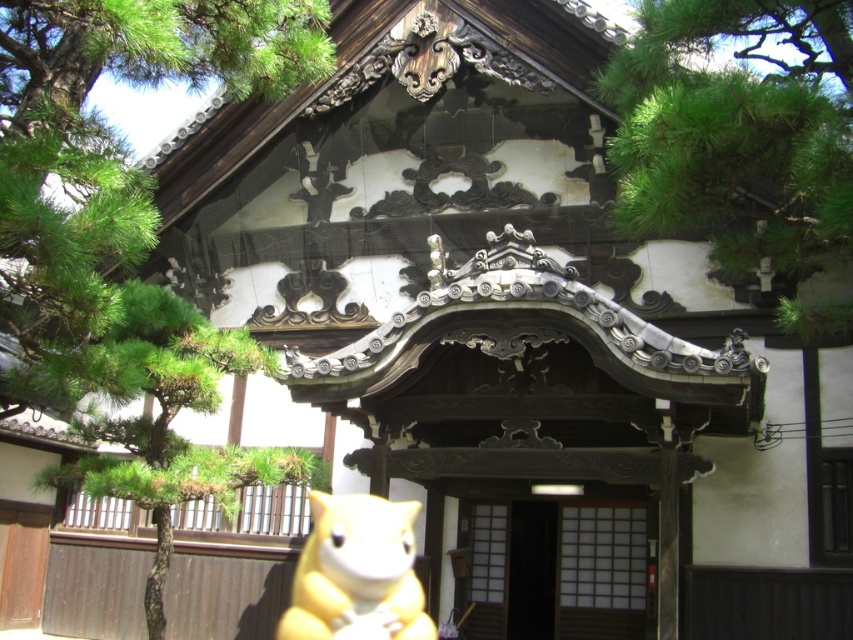
Which of these two, green leafy tree at upper right or yellow plush toy at lower center, stands taller?

With more height is green leafy tree at upper right.

Is green leafy tree at upper right below yellow plush toy at lower center?

No, green leafy tree at upper right is not below yellow plush toy at lower center.

Find the location of a particular element. This screenshot has width=853, height=640. green leafy tree at upper right is located at coordinates (737, 131).

Find the location of a particular element. This screenshot has width=853, height=640. green leafy tree at upper right is located at coordinates (737, 131).

Is point (751, 253) closer to camera compared to point (102, 340)?

No, it is not.

Does green leafy tree at upper right have a smaller size compared to green textured tree at left?

Indeed, green leafy tree at upper right has a smaller size compared to green textured tree at left.

Where is `green leafy tree at upper right`? Image resolution: width=853 pixels, height=640 pixels. green leafy tree at upper right is located at coordinates tap(737, 131).

What are the coordinates of `green leafy tree at upper right` in the screenshot? It's located at (737, 131).

Between green pine tree at upper left and green leafy tree at upper right, which one is positioned lower?

green pine tree at upper left

Is point (215, 38) closer to camera compared to point (675, 32)?

No, it is not.

Where is `green pine tree at upper left`? The image size is (853, 640). green pine tree at upper left is located at coordinates (108, 148).